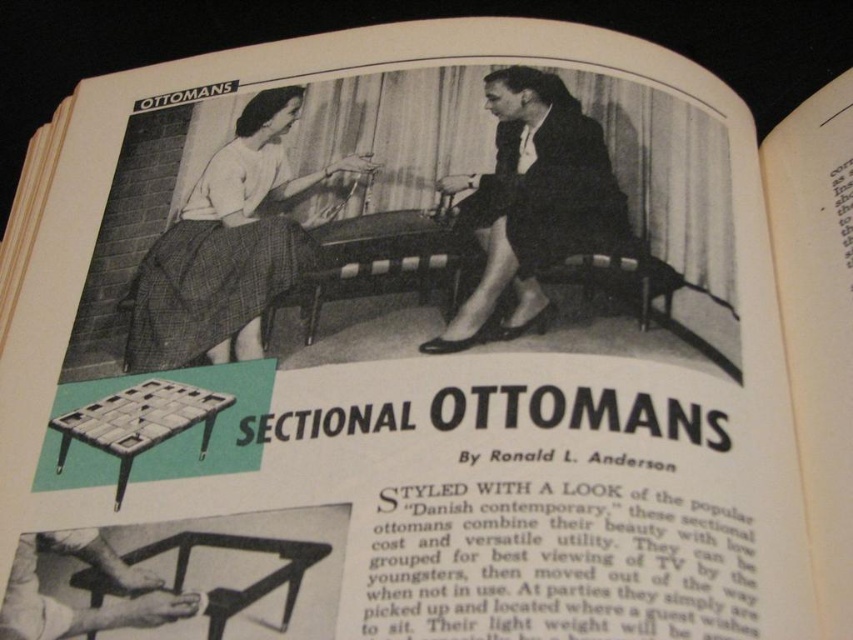
Who is more forward, (257, 193) or (608, 164)?

Point (608, 164)

Can you confirm if white woven skirt at upper left is positioned to the left of dark suit at center?

Indeed, white woven skirt at upper left is positioned on the left side of dark suit at center.

Which is behind, point (154, 298) or point (469, 336)?

Positioned behind is point (154, 298).

This screenshot has height=640, width=853. I want to click on white woven skirt at upper left, so click(227, 246).